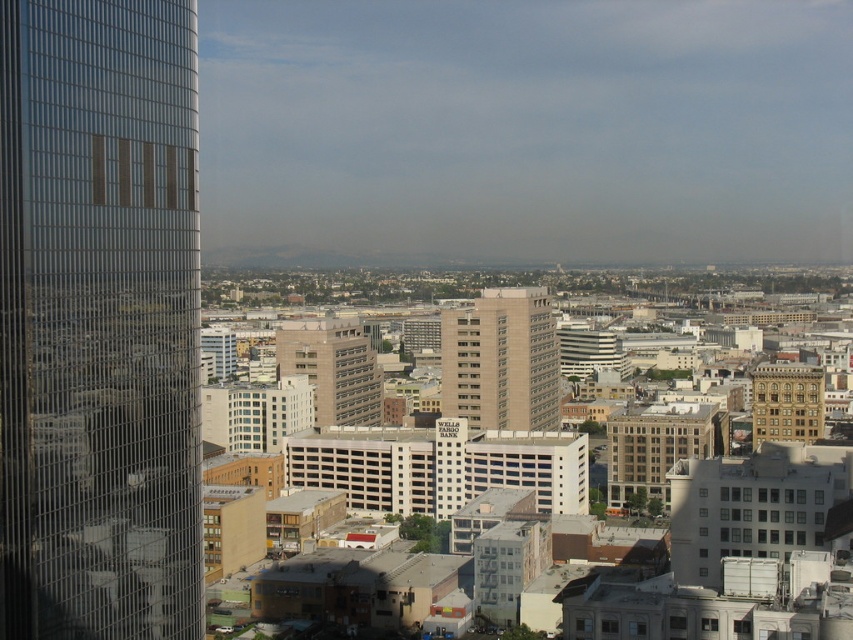
Is point (613, 456) farther from viewer compared to point (753, 371)?

That is False.

The image size is (853, 640). Find the location of `beige stone building at center`. beige stone building at center is located at coordinates (659, 445).

At what (x,y) coordinates should I click in order to perform the action: click on beige stone building at center. Please return your answer as a coordinate pair (x, y). The height and width of the screenshot is (640, 853). Looking at the image, I should click on (659, 445).

Is point (131, 547) behind point (276, 332)?

That is False.

Who is more forward, (9, 36) or (345, 401)?

Point (9, 36) is more forward.

Where is `glassy reflective skyscraper at left`? This screenshot has height=640, width=853. glassy reflective skyscraper at left is located at coordinates (97, 320).

Does glassy reflective skyscraper at left have a greater height compared to beige stone building at center?

Indeed, glassy reflective skyscraper at left has a greater height compared to beige stone building at center.

The image size is (853, 640). I want to click on glassy reflective skyscraper at left, so click(x=97, y=320).

Image resolution: width=853 pixels, height=640 pixels. I want to click on glassy reflective skyscraper at left, so click(x=97, y=320).